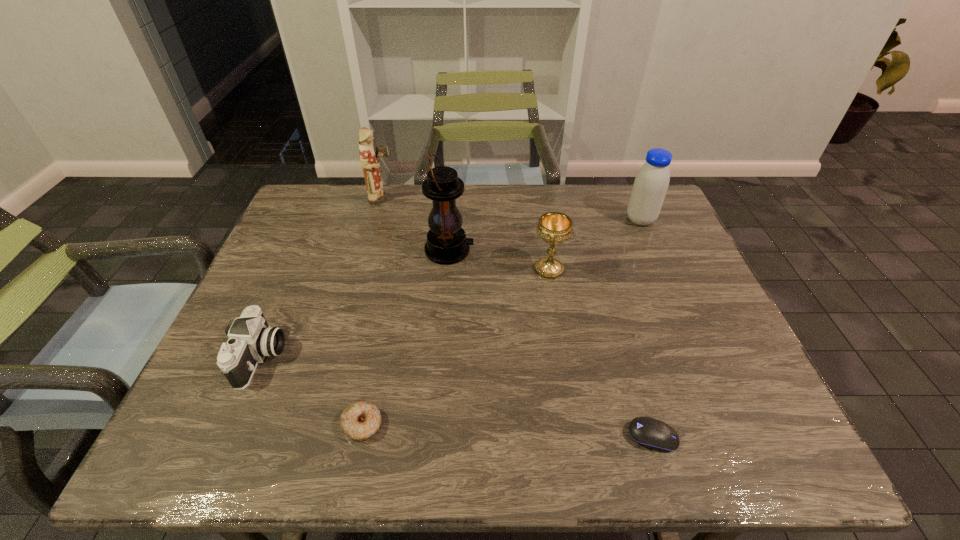
The width and height of the screenshot is (960, 540). I want to click on soya milk present at the far edge, so click(651, 183).

The width and height of the screenshot is (960, 540). In order to click on doughnut that is at the near edge in this screenshot , I will do (360, 420).

At what (x,y) coordinates should I click in order to perform the action: click on computer mouse that is positioned at the near edge. Please return your answer as a coordinate pair (x, y). This screenshot has height=540, width=960. Looking at the image, I should click on (648, 432).

This screenshot has width=960, height=540. I want to click on object positioned at the left edge, so click(250, 338).

The height and width of the screenshot is (540, 960). In order to click on object positioned at the right edge in this screenshot , I will do `click(651, 183)`.

Locate an element on the screen. object present at the far right corner is located at coordinates (651, 183).

You are a GUI agent. You are given a task and a screenshot of the screen. Output one action in this format:
    pyautogui.click(x=<x>, y=<y>)
    Task: Click on the vacant space at the far edge
    This screenshot has height=540, width=960.
    Given the screenshot: What is the action you would take?
    pyautogui.click(x=499, y=192)

The width and height of the screenshot is (960, 540). I want to click on free region at the near edge of the desktop, so click(542, 442).

Where is `vacant area at the right edge`? vacant area at the right edge is located at coordinates (662, 294).

Where is `free space at the far left corner of the desktop`? This screenshot has height=540, width=960. free space at the far left corner of the desktop is located at coordinates (300, 213).